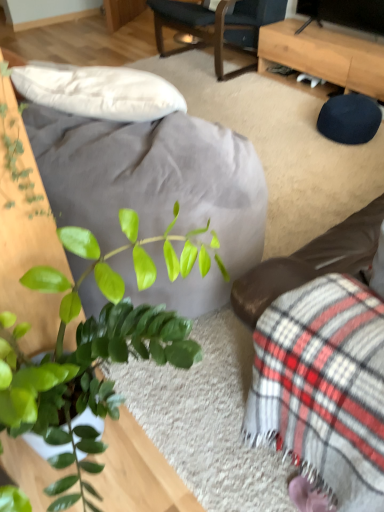
Question: Is light brown wooden desk at upper right surrounded by dark blue fabric chair at upper center?

Choices:
 (A) yes
 (B) no

Answer: (B)

Question: Is dark blue fabric chair at upper center positioned with its back to light brown wooden desk at upper right?

Choices:
 (A) no
 (B) yes

Answer: (A)

Question: Considering the relative sizes of dark blue fabric chair at upper center and light brown wooden desk at upper right in the image provided, is dark blue fabric chair at upper center taller than light brown wooden desk at upper right?

Choices:
 (A) no
 (B) yes

Answer: (B)

Question: From the image's perspective, does dark blue fabric chair at upper center appear lower than light brown wooden desk at upper right?

Choices:
 (A) no
 (B) yes

Answer: (A)

Question: Can you confirm if dark blue fabric chair at upper center is positioned to the left of light brown wooden desk at upper right?

Choices:
 (A) no
 (B) yes

Answer: (B)

Question: From a real-world perspective, is dark blue fabric chair at upper center on top of light brown wooden desk at upper right?

Choices:
 (A) no
 (B) yes

Answer: (B)

Question: From the image's perspective, is plaid fabric couch at lower right located beneath light brown wooden desk at upper right?

Choices:
 (A) yes
 (B) no

Answer: (A)

Question: Could you tell me if plaid fabric couch at lower right is turned towards light brown wooden desk at upper right?

Choices:
 (A) yes
 (B) no

Answer: (B)

Question: Is plaid fabric couch at lower right positioned with its back to light brown wooden desk at upper right?

Choices:
 (A) no
 (B) yes

Answer: (A)

Question: From the image's perspective, is plaid fabric couch at lower right located above light brown wooden desk at upper right?

Choices:
 (A) yes
 (B) no

Answer: (B)

Question: Is plaid fabric couch at lower right not within light brown wooden desk at upper right?

Choices:
 (A) no
 (B) yes

Answer: (B)

Question: Would you say plaid fabric couch at lower right is a long distance from light brown wooden desk at upper right?

Choices:
 (A) no
 (B) yes

Answer: (B)

Question: Is light brown wooden desk at upper right to the right of dark blue fabric chair at upper center from the viewer's perspective?

Choices:
 (A) no
 (B) yes

Answer: (B)